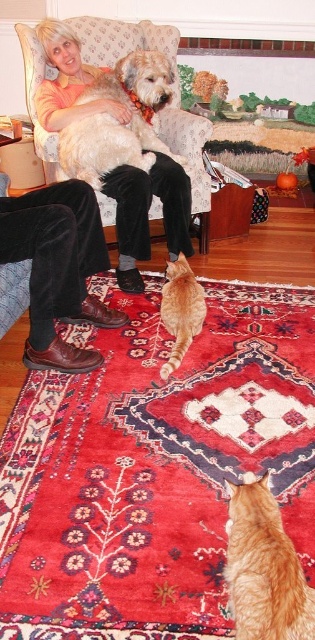
Question: Does soft golden fur at center have a larger size compared to orange fur cat at center?

Choices:
 (A) yes
 (B) no

Answer: (A)

Question: Can you confirm if tabby fur cat at lower center is positioned above velvet armchair at upper center?

Choices:
 (A) yes
 (B) no

Answer: (B)

Question: Which is nearer to the tabby fur cat at lower center?

Choices:
 (A) orange fur cat at center
 (B) soft golden fur at center
 (C) velvet armchair at upper center

Answer: (A)

Question: Which point appears farthest from the camera in this image?

Choices:
 (A) (22, 28)
 (B) (160, 312)

Answer: (A)

Question: Does velvet armchair at upper center have a lesser width compared to soft golden fur at center?

Choices:
 (A) yes
 (B) no

Answer: (B)

Question: Which is nearer to the soft golden fur at center?

Choices:
 (A) tabby fur cat at lower center
 (B) orange fur cat at center

Answer: (B)